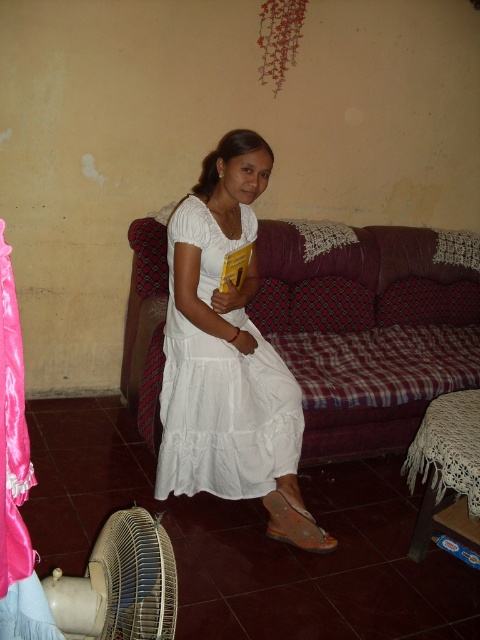
Which is above, white cotton dress at center or beige plastic fan at lower left?

Positioned higher is white cotton dress at center.

Can you confirm if white cotton dress at center is smaller than beige plastic fan at lower left?

No, white cotton dress at center is not smaller than beige plastic fan at lower left.

Describe the element at coordinates (220, 384) in the screenshot. I see `white cotton dress at center` at that location.

Locate an element on the screen. white cotton dress at center is located at coordinates (220, 384).

Is plaid fabric couch at center in front of beige plastic fan at lower left?

No.

Is plaid fabric couch at center above beige plastic fan at lower left?

Yes.

Is point (369, 237) farther from viewer compared to point (108, 637)?

Yes, it is behind point (108, 637).

Image resolution: width=480 pixels, height=640 pixels. What are the coordinates of `plaid fabric couch at center` in the screenshot? It's located at (367, 332).

Consider the image. Does plaid fabric couch at center come behind white cotton dress at center?

Yes, plaid fabric couch at center is behind white cotton dress at center.

Does plaid fabric couch at center appear on the left side of white cotton dress at center?

No, plaid fabric couch at center is not to the left of white cotton dress at center.

Does point (346, 365) lie in front of point (223, 340)?

No, (346, 365) is further to viewer.

You are a GUI agent. You are given a task and a screenshot of the screen. Output one action in this format:
    pyautogui.click(x=<x>, y=<y>)
    Task: Click on the plaid fabric couch at center
    This screenshot has width=480, height=640.
    Given the screenshot: What is the action you would take?
    pyautogui.click(x=367, y=332)